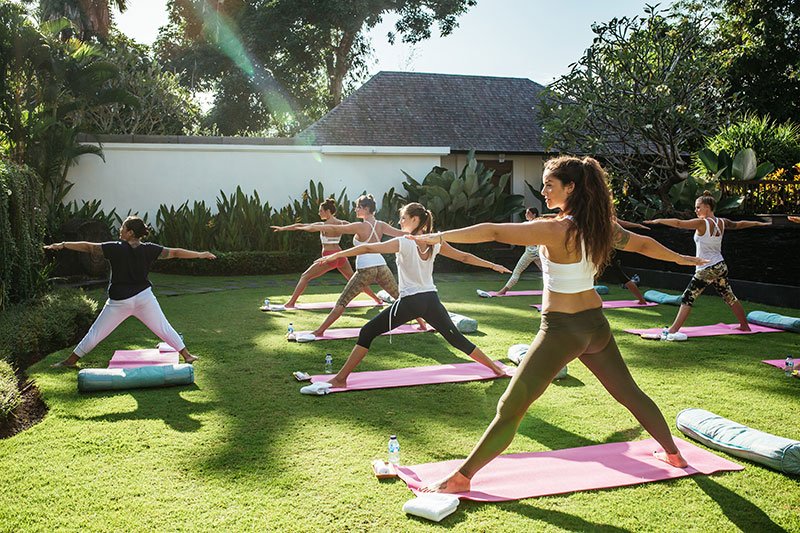
The image size is (800, 533). In order to click on tropical plant in this screenshot , I will do `click(454, 191)`.